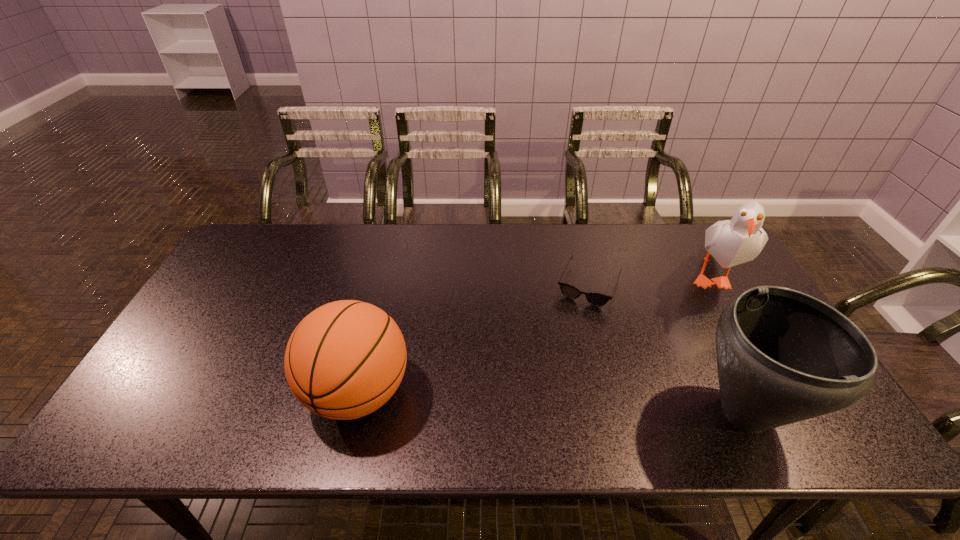
Locate an element on the screen. empty space that is in between the urn and the shortest object is located at coordinates (667, 348).

In order to click on unoccupied area between the urn and the shortest object in this screenshot , I will do `click(667, 348)`.

You are a GUI agent. You are given a task and a screenshot of the screen. Output one action in this format:
    pyautogui.click(x=<x>, y=<y>)
    Task: Click on the blank region between the third object from right to left and the basketball
    The image size is (960, 540).
    Given the screenshot: What is the action you would take?
    pyautogui.click(x=473, y=339)

Locate an element on the screen. free spot between the urn and the leftmost object is located at coordinates (551, 401).

Where is `free spot between the second object from left to right and the urn`? This screenshot has height=540, width=960. free spot between the second object from left to right and the urn is located at coordinates (667, 348).

Identify which object is the nearest to the gull. Please provide its 2D coordinates. Your answer should be formatted as a tuple, i.e. [(x, y)], where the tuple contains the x and y coordinates of a point satisfying the conditions above.

[(783, 356)]

Where is `the third closest object to the shortest object`? This screenshot has width=960, height=540. the third closest object to the shortest object is located at coordinates 346,359.

The width and height of the screenshot is (960, 540). Identify the location of blank area in the image that satisfies the following two spatial constraints: 1. on the front side of the urn; 2. on the right side of the basketball. (353, 411).

Where is `free space that satisfies the following two spatial constraints: 1. on the back side of the sunglasses; 2. on the right side of the gull`? This screenshot has height=540, width=960. free space that satisfies the following two spatial constraints: 1. on the back side of the sunglasses; 2. on the right side of the gull is located at coordinates (587, 275).